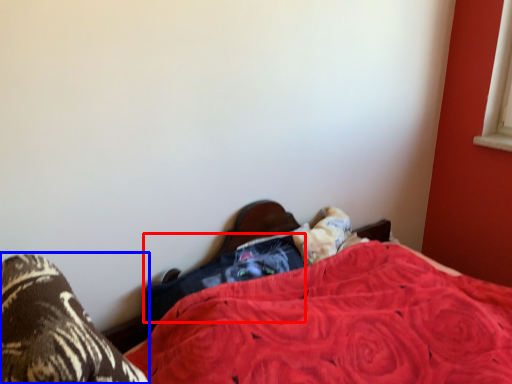
Question: Which object is closer to the camera taking this photo, clothing (highlighted by a red box) or footwear (highlighted by a blue box)?

Choices:
 (A) clothing
 (B) footwear

Answer: (B)